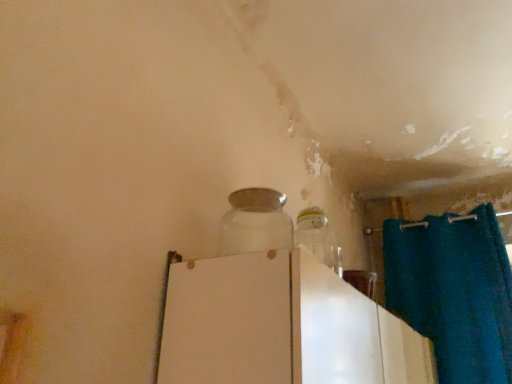
The image size is (512, 384). What do you see at coordinates (255, 222) in the screenshot?
I see `transparent glass jar at center` at bounding box center [255, 222].

Measure the distance between transparent glass jar at center and camera.

They are 3.44 feet apart.

Identify the location of transparent glass jar at center. (255, 222).

Measure the distance between point [219,244] and camera.

The distance of point [219,244] from camera is 3.79 feet.

Describe the element at coordinates (281, 326) in the screenshot. I see `white glossy refrigerator at center` at that location.

What is the approximate height of white glossy refrigerator at center?

It is 10.77 inches.

I want to click on white glossy refrigerator at center, so click(281, 326).

The width and height of the screenshot is (512, 384). What are the coordinates of `transparent glass jar at center` in the screenshot? It's located at pos(255,222).

Is transparent glass jar at center at the left side of white glossy refrigerator at center?

Yes, transparent glass jar at center is to the left of white glossy refrigerator at center.

Considering the relative positions of transparent glass jar at center and white glossy refrigerator at center in the image provided, is transparent glass jar at center behind white glossy refrigerator at center?

Yes, it is behind white glossy refrigerator at center.

Is point (259, 197) less distant than point (424, 341)?

Yes, it is in front of point (424, 341).

In the scene shown: From the image's perspective, which object appears higher, transparent glass jar at center or white glossy refrigerator at center?

transparent glass jar at center is shown above in the image.

Consider the image. From a real-world perspective, does transparent glass jar at center stand above white glossy refrigerator at center?

Indeed, from a real-world perspective, transparent glass jar at center stands above white glossy refrigerator at center.

Does transparent glass jar at center have a lesser width compared to white glossy refrigerator at center?

Correct, the width of transparent glass jar at center is less than that of white glossy refrigerator at center.

Considering the sizes of objects transparent glass jar at center and white glossy refrigerator at center in the image provided, who is taller, transparent glass jar at center or white glossy refrigerator at center?

white glossy refrigerator at center is taller.

Considering the sizes of objects transparent glass jar at center and white glossy refrigerator at center in the image provided, who is smaller, transparent glass jar at center or white glossy refrigerator at center?

Smaller between the two is transparent glass jar at center.

Is white glossy refrigerator at center surrounded by transparent glass jar at center?

No.

Are transparent glass jar at center and white glossy refrigerator at center making contact?

No, transparent glass jar at center is not touching white glossy refrigerator at center.

Consider the image. Is white glossy refrigerator at center at the back of transparent glass jar at center?

That's not correct — transparent glass jar at center is not looking away from white glossy refrigerator at center.

You are a GUI agent. You are given a task and a screenshot of the screen. Output one action in this format:
    pyautogui.click(x=<x>, y=<y>)
    Task: Click on the bottle above the white glossy refrigerator at center (from a real-world perspective)
    
    Given the screenshot: What is the action you would take?
    pyautogui.click(x=255, y=222)

Is white glossy refrigerator at center at the left side of transparent glass jar at center?

In fact, white glossy refrigerator at center is to the right of transparent glass jar at center.

Is white glossy refrigerator at center further to the viewer compared to transparent glass jar at center?

That is False.

Which is closer to the camera, (x=268, y=293) or (x=252, y=250)?

Positioned in front is point (x=268, y=293).

From the image's perspective, is white glossy refrigerator at center below transparent glass jar at center?

Yes, from the image's perspective, white glossy refrigerator at center is beneath transparent glass jar at center.

From a real-world perspective, is white glossy refrigerator at center on top of transparent glass jar at center?

No, from a real-world perspective, white glossy refrigerator at center is not above transparent glass jar at center.

Which of these two, white glossy refrigerator at center or transparent glass jar at center, is thinner?

Thinner between the two is transparent glass jar at center.

In terms of height, does white glossy refrigerator at center look taller or shorter compared to transparent glass jar at center?

Clearly, white glossy refrigerator at center is taller compared to transparent glass jar at center.

Which of these two, white glossy refrigerator at center or transparent glass jar at center, is smaller?

transparent glass jar at center.

Is white glossy refrigerator at center outside of transparent glass jar at center?

Yes.

Is white glossy refrigerator at center next to transparent glass jar at center and touching it?

No.

Is transparent glass jar at center at the back of white glossy refrigerator at center?

white glossy refrigerator at center does not have its back to transparent glass jar at center.

Identify the location of bottle that is above the white glossy refrigerator at center (from a real-world perspective). (255, 222).

Find the location of a particular element. bottle behind the white glossy refrigerator at center is located at coordinates (255, 222).

Where is `appliance below the transparent glass jar at center (from the image's perspective)`? appliance below the transparent glass jar at center (from the image's perspective) is located at coordinates (281, 326).